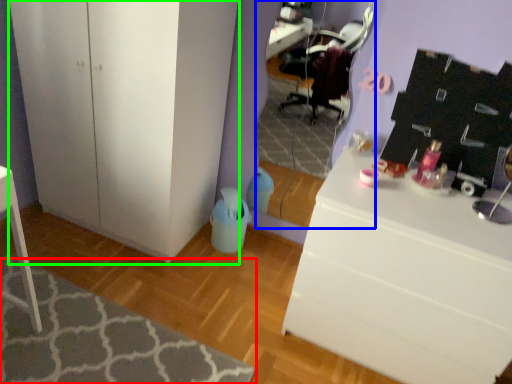
Question: Which object is positioned closest to mat (highlighted by a red box)? Select from mirror (highlighted by a blue box) and cabinetry (highlighted by a green box).

Choices:
 (A) mirror
 (B) cabinetry

Answer: (B)